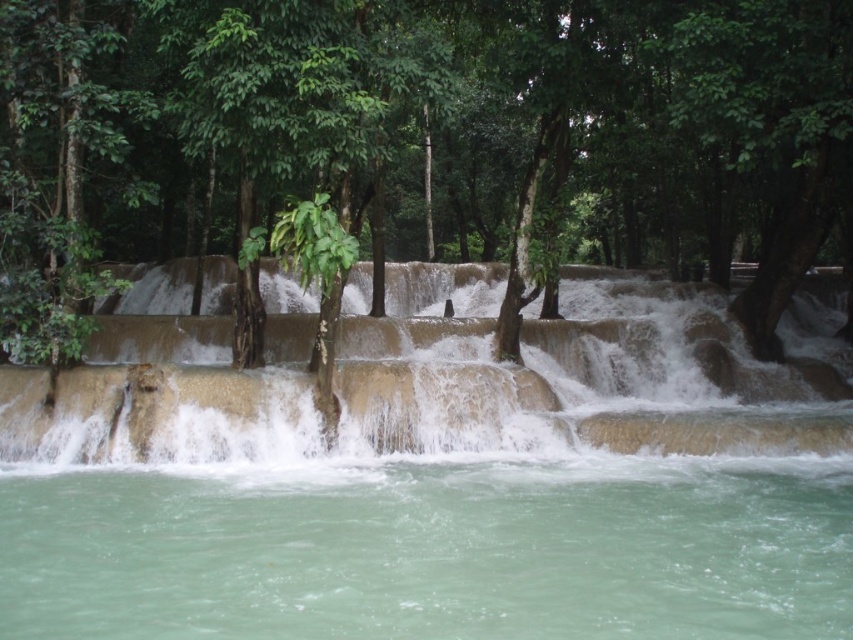
Between point (430, 560) and point (480, 406), which one is positioned behind?

The point (480, 406) is more distant.

Is clear water at lower center shorter than brown textured waterfall at center?

Correct, clear water at lower center is not as tall as brown textured waterfall at center.

Between point (247, 576) and point (292, 404), which one is positioned behind?

The point (292, 404) is behind.

Identify the location of clear water at lower center. The image size is (853, 640). (431, 548).

Where is `green leafy tree at center`? This screenshot has width=853, height=640. green leafy tree at center is located at coordinates (456, 124).

Between green leafy tree at center and brown textured waterfall at center, which one appears on the right side from the viewer's perspective?

brown textured waterfall at center

Locate an element on the screen. This screenshot has width=853, height=640. green leafy tree at center is located at coordinates (456, 124).

Does green leafy tree at center appear under clear water at lower center?

No.

Is point (663, 244) more distant than point (466, 524)?

Yes, point (663, 244) is behind point (466, 524).

Find the location of a particular element. This screenshot has height=640, width=853. green leafy tree at center is located at coordinates (456, 124).